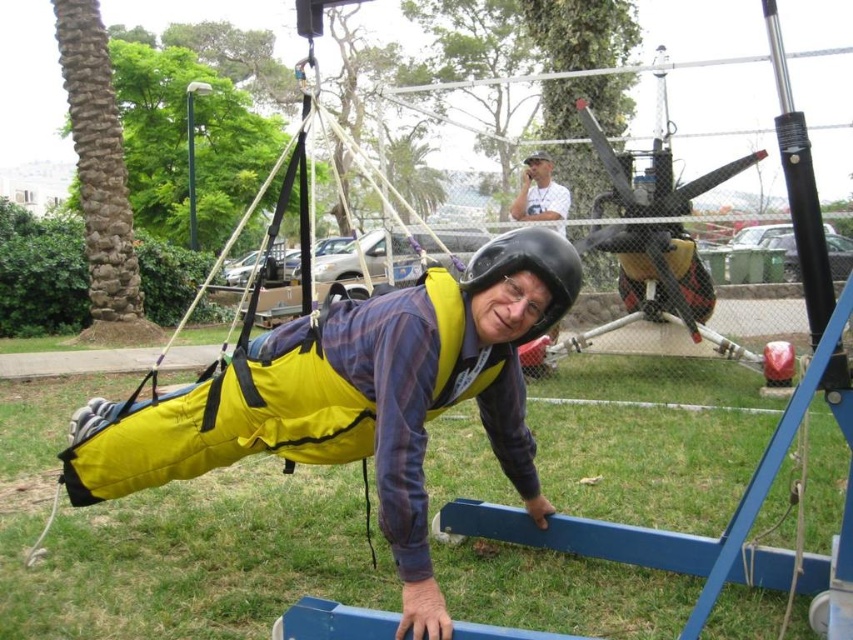
Is point (515, 426) farther from camera compared to point (569, 248)?

Yes, point (515, 426) is behind point (569, 248).

Between point (422, 404) and point (494, 259), which one is positioned behind?

The point (422, 404) is behind.

Who is more distant from viewer, [105,486] or [575,282]?

Point [105,486]

Locate an element on the screen. yellow fabric at center is located at coordinates (357, 397).

Does black matte helmet at center appear under white cotton shirt at upper center?

Indeed, black matte helmet at center is positioned under white cotton shirt at upper center.

Can you confirm if black matte helmet at center is positioned to the left of white cotton shirt at upper center?

Indeed, black matte helmet at center is positioned on the left side of white cotton shirt at upper center.

Looking at this image, who is more distant from viewer, (x=556, y=280) or (x=526, y=195)?

The point (x=526, y=195) is more distant.

At what (x,y) coordinates should I click in order to perform the action: click on black matte helmet at center. Please return your answer as a coordinate pair (x, y). The image size is (853, 640). Looking at the image, I should click on (529, 269).

This screenshot has height=640, width=853. What are the coordinates of `yellow fabric at center` in the screenshot? It's located at (357, 397).

Which of these two, yellow fabric at center or white cotton shirt at upper center, stands taller?

yellow fabric at center is taller.

Who is more forward, (416, 572) or (543, 208)?

Point (416, 572) is more forward.

Find the location of a particular element. yellow fabric at center is located at coordinates (357, 397).